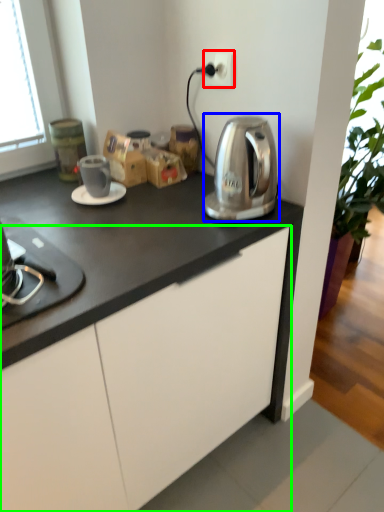
Question: Which object is positioned farthest from electric outlet (highlighted by a red box)? Select from kitchen appliance (highlighted by a blue box) and cabinetry (highlighted by a green box).

Choices:
 (A) kitchen appliance
 (B) cabinetry

Answer: (B)